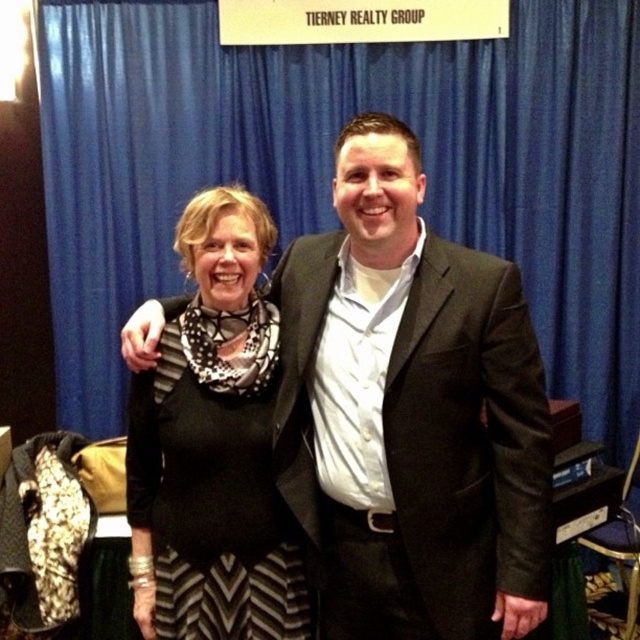
Question: Is blue fabric curtain at upper center wider than black dotted scarf at center?

Choices:
 (A) yes
 (B) no

Answer: (A)

Question: Can you confirm if black matte suit at center is thinner than black dotted scarf at center?

Choices:
 (A) yes
 (B) no

Answer: (B)

Question: Does black matte suit at center lie in front of black dotted scarf at center?

Choices:
 (A) yes
 (B) no

Answer: (A)

Question: Estimate the real-world distances between objects in this image. Which object is farther from the blue fabric curtain at upper center?

Choices:
 (A) black dotted scarf at center
 (B) black matte suit at center

Answer: (B)

Question: Which object appears closest to the camera in this image?

Choices:
 (A) black dotted scarf at center
 (B) blue fabric curtain at upper center

Answer: (A)

Question: Which object is positioned closest to the black matte suit at center?

Choices:
 (A) blue fabric curtain at upper center
 (B) black dotted scarf at center

Answer: (B)